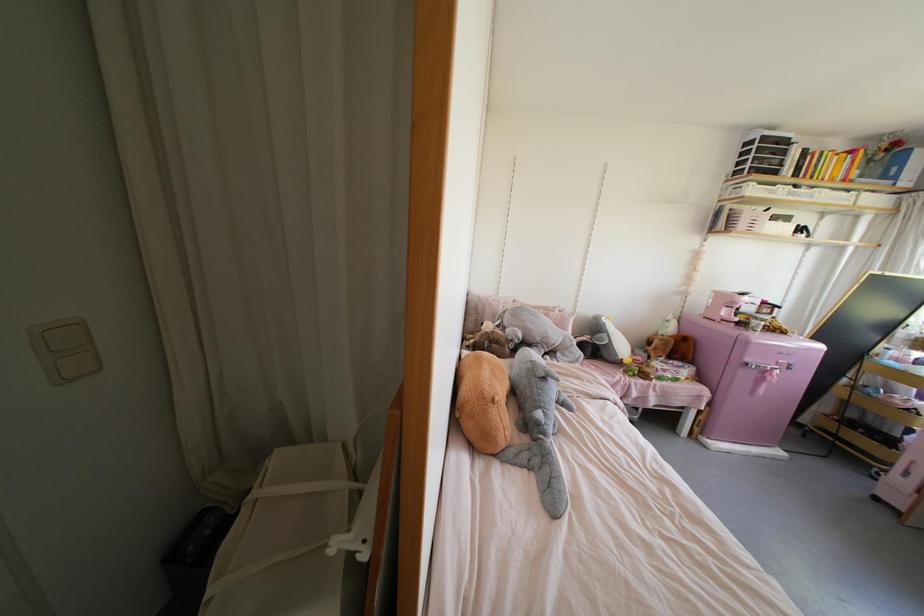
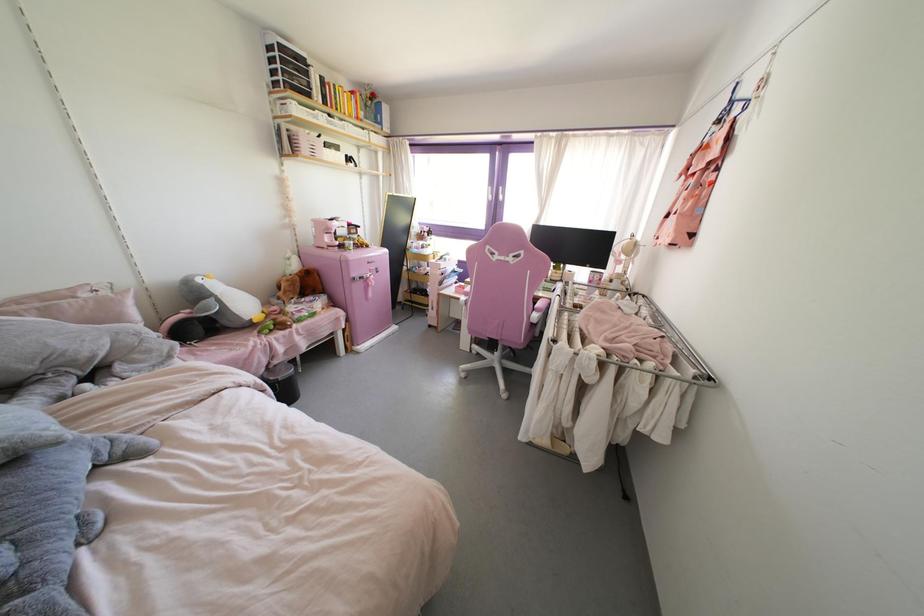
In the second image, find the point that corresponds to point 786,368 in the first image.

(377, 272)